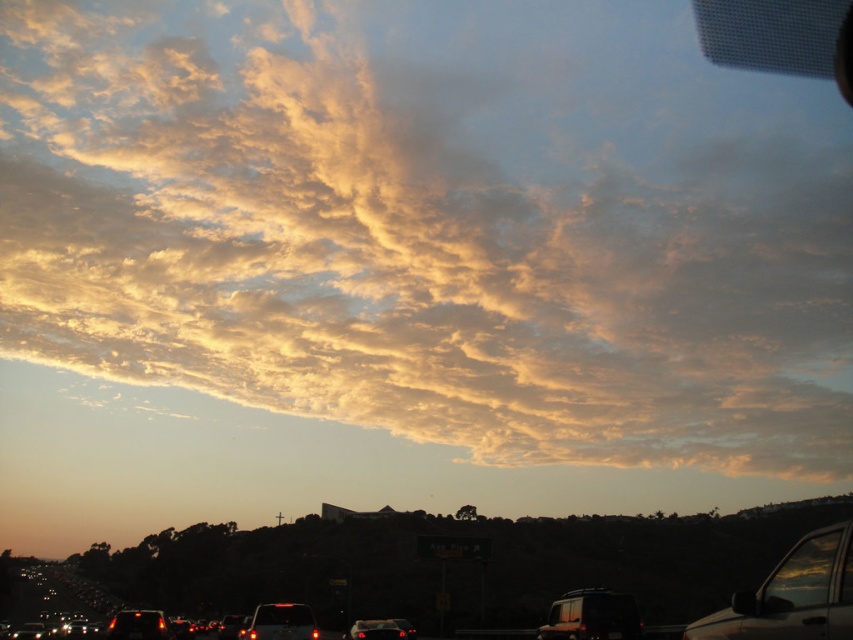
You are driving a car that is 5 meters long and want to park between the metallic silver van at lower right and the matte black car at center. Is there enough space between them to park your car?

The distance between the metallic silver van at lower right and the matte black car at center is 9.52 meters. Since your car is 5 meters long, there is sufficient space to park between them as 9.52 meters is greater than 5 meters.

You are a photographer wanting to capture both the metallic silver car at lower right and the matte black car at center in a single frame. Based on their positions, which car should you focus on first to ensure both are in the shot?

The metallic silver car at lower right is above the matte black car at center, so focusing on the matte black car at center first will allow you to frame both cars within the shot.

You are a photographer wanting to capture both the metallic silver car at lower right and the matte black car at center in a single frame. Given their sizes, which car should you move closer to in order to make them appear similar in size in the photo?

Since the metallic silver car at lower right is smaller than the matte black car at center, you should move closer to the metallic silver car at lower right to make them appear similar in size in the photo.